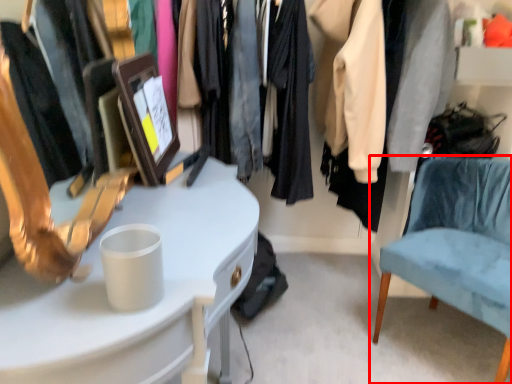
Question: In this image, where is chair (annotated by the red box) located relative to desk?

Choices:
 (A) left
 (B) right

Answer: (B)